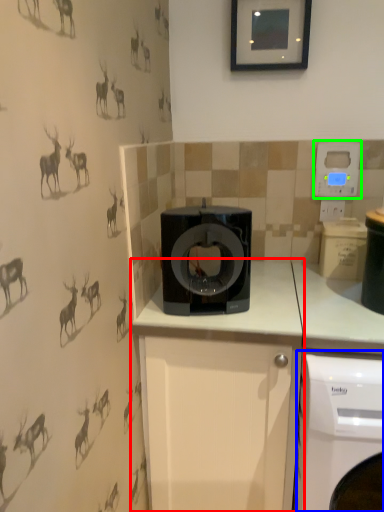
Question: Which object is the farthest from cabinetry (highlighted by a red box)? Choose among these: washing machine (highlighted by a blue box) or thermostat (highlighted by a green box).

Choices:
 (A) washing machine
 (B) thermostat

Answer: (B)